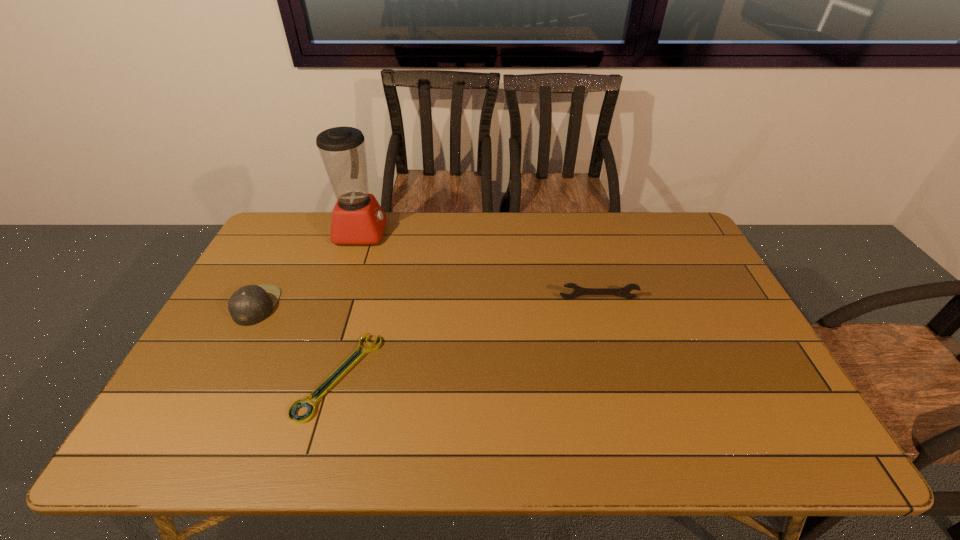
I want to click on the closest object relative to the shortest object, so click(251, 304).

Locate an element on the screen. This screenshot has height=540, width=960. object that is the third closest to the taller wrench is located at coordinates (251, 304).

At what (x,y) coordinates should I click in order to perform the action: click on free location that satisfies the following two spatial constraints: 1. on the back side of the shorter wrench; 2. on the front of the tallest object near the controls. Please return your answer as a coordinate pair (x, y). The image size is (960, 540). Looking at the image, I should click on (380, 232).

Where is `vacant position in the image that satisfies the following two spatial constraints: 1. on the front of the nearest object near the controls; 2. on the right side of the farthest object`? vacant position in the image that satisfies the following two spatial constraints: 1. on the front of the nearest object near the controls; 2. on the right side of the farthest object is located at coordinates (312, 376).

Where is `vacant region that satisfies the following two spatial constraints: 1. on the front of the nearer wrench near the controls; 2. on the right side of the tallest object`? vacant region that satisfies the following two spatial constraints: 1. on the front of the nearer wrench near the controls; 2. on the right side of the tallest object is located at coordinates (x=312, y=376).

At what (x,y) coordinates should I click in order to perform the action: click on free spot that satisfies the following two spatial constraints: 1. on the front of the shorter wrench near the controls; 2. on the left side of the farthest object. Please return your answer as a coordinate pair (x, y). Image resolution: width=960 pixels, height=540 pixels. Looking at the image, I should click on (312, 376).